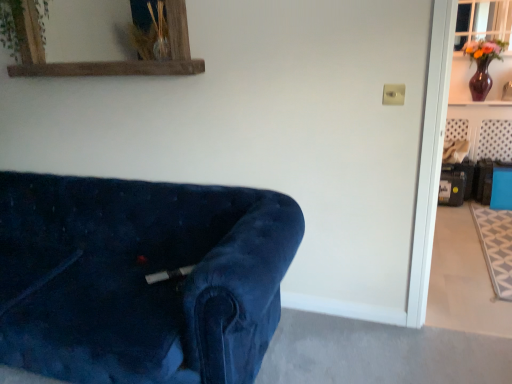
Question: From a real-world perspective, does green leafy plant at upper left sit lower than rustic wood mirror at upper left?

Choices:
 (A) yes
 (B) no

Answer: (B)

Question: Is green leafy plant at upper left at the left side of rustic wood mirror at upper left?

Choices:
 (A) no
 (B) yes

Answer: (B)

Question: Is green leafy plant at upper left oriented towards rustic wood mirror at upper left?

Choices:
 (A) yes
 (B) no

Answer: (A)

Question: Is rustic wood mirror at upper left surrounded by green leafy plant at upper left?

Choices:
 (A) no
 (B) yes

Answer: (A)

Question: Can you confirm if green leafy plant at upper left is shorter than rustic wood mirror at upper left?

Choices:
 (A) no
 (B) yes

Answer: (B)

Question: Is point (4, 4) closer or farther from the camera than point (497, 31)?

Choices:
 (A) closer
 (B) farther

Answer: (A)

Question: Is green leafy plant at upper left to the left or to the right of clear glass window at upper right in the image?

Choices:
 (A) left
 (B) right

Answer: (A)

Question: From the image's perspective, relative to clear glass window at upper right, is green leafy plant at upper left above or below?

Choices:
 (A) above
 (B) below

Answer: (B)

Question: Looking at the image, does green leafy plant at upper left seem bigger or smaller compared to clear glass window at upper right?

Choices:
 (A) big
 (B) small

Answer: (A)

Question: Considering the positions of rustic wood mirror at upper left and matte purple vase at upper right in the image, is rustic wood mirror at upper left taller or shorter than matte purple vase at upper right?

Choices:
 (A) short
 (B) tall

Answer: (A)

Question: Do you think rustic wood mirror at upper left is within matte purple vase at upper right, or outside of it?

Choices:
 (A) outside
 (B) inside

Answer: (A)

Question: In the image, is rustic wood mirror at upper left on the left side or the right side of matte purple vase at upper right?

Choices:
 (A) right
 (B) left

Answer: (B)

Question: Is rustic wood mirror at upper left in front of or behind matte purple vase at upper right in the image?

Choices:
 (A) front
 (B) behind

Answer: (A)

Question: From the image's perspective, is velvet blue couch at lower left positioned above or below clear glass window at upper right?

Choices:
 (A) below
 (B) above

Answer: (A)

Question: Is point (10, 360) positioned closer to the camera than point (463, 13)?

Choices:
 (A) closer
 (B) farther

Answer: (A)